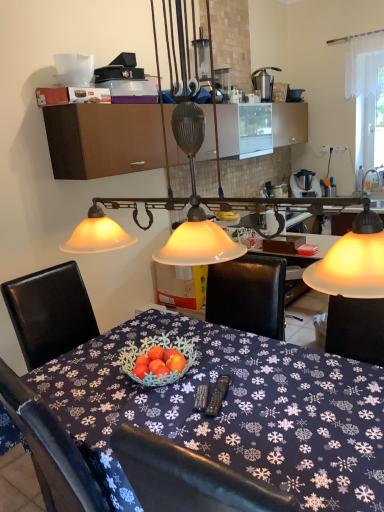
Locate an element on the screen. The width and height of the screenshot is (384, 512). vacant space situated above blue fabric tablecloth at center (from a real-world perspective) is located at coordinates (186, 380).